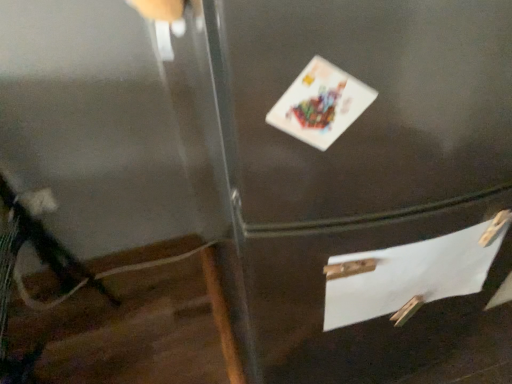
Question: In the image, is white paper postcard at upper center positioned in front of or behind white paper at lower right?

Choices:
 (A) front
 (B) behind

Answer: (A)

Question: Considering the relative positions of white paper postcard at upper center and white paper at lower right in the image provided, is white paper postcard at upper center to the left or to the right of white paper at lower right?

Choices:
 (A) left
 (B) right

Answer: (A)

Question: Looking at their shapes, would you say white paper postcard at upper center is wider or thinner than white paper at lower right?

Choices:
 (A) thin
 (B) wide

Answer: (B)

Question: Relative to white paper postcard at upper center, is white paper at lower right in front or behind?

Choices:
 (A) front
 (B) behind

Answer: (B)

Question: Is white paper at lower right to the left or to the right of white paper postcard at upper center in the image?

Choices:
 (A) left
 (B) right

Answer: (B)

Question: Is white paper at lower right inside the boundaries of white paper postcard at upper center, or outside?

Choices:
 (A) outside
 (B) inside

Answer: (A)

Question: From a real-world perspective, is white paper at lower right positioned above or below white paper postcard at upper center?

Choices:
 (A) above
 (B) below

Answer: (B)